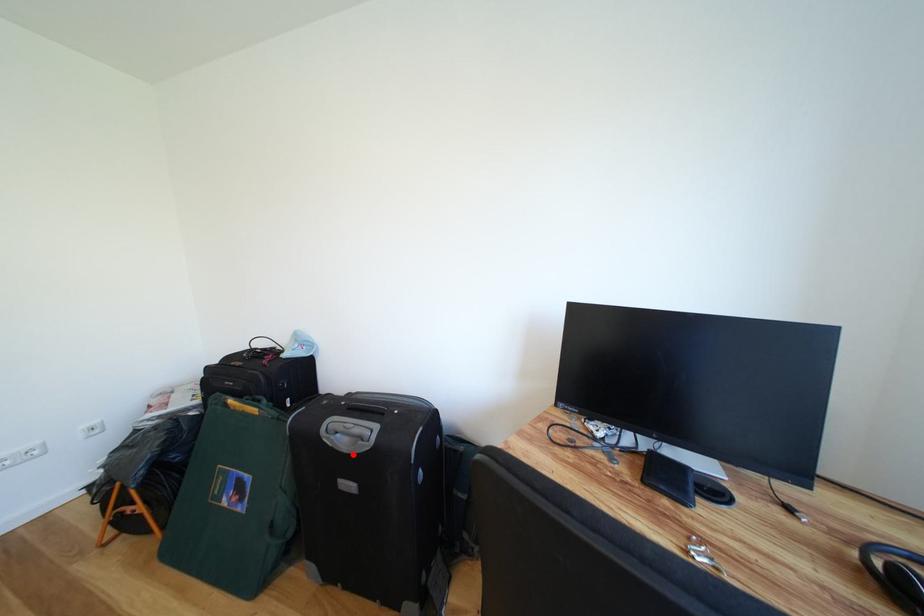
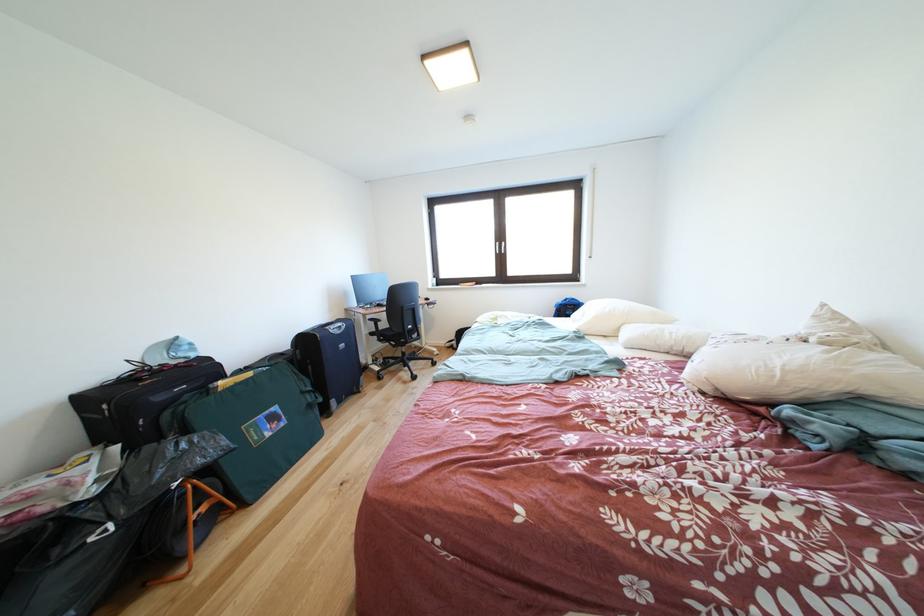
Question: I am providing you with two images of the same scene from different viewpoints. Image1 has a red point marked. In image2, the corresponding 3D location appears at what relative position? Reply with the corresponding letter.

Choices:
 (A) Closer
 (B) Farther

Answer: (A)